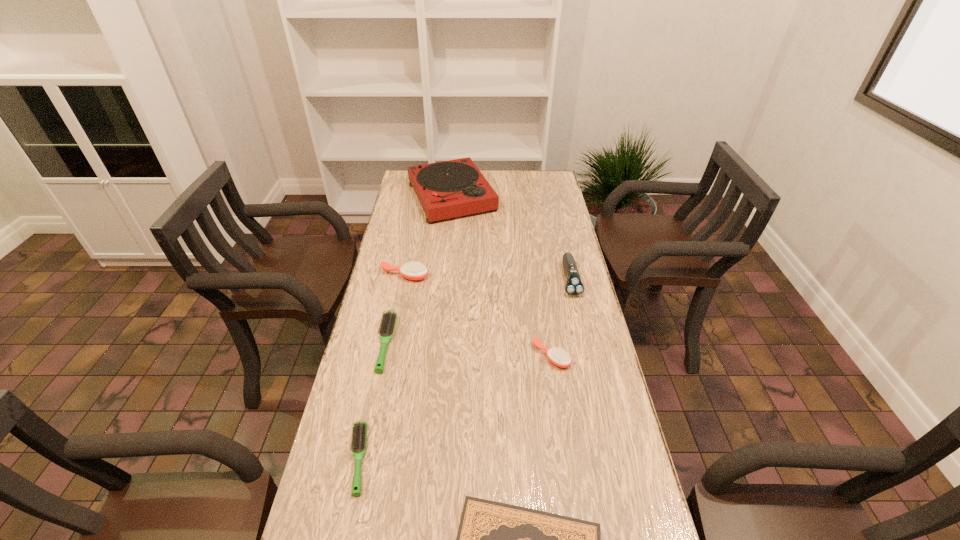
Where is `the sixth farthest object`? This screenshot has width=960, height=540. the sixth farthest object is located at coordinates (359, 437).

Find the location of a particular element. Image resolution: width=960 pixels, height=540 pixels. vacant region located 0.240m on the right of the farthest object is located at coordinates (551, 197).

The image size is (960, 540). Find the location of `vacant space located 0.380m on the head of the second tallest object`. vacant space located 0.380m on the head of the second tallest object is located at coordinates (596, 396).

This screenshot has height=540, width=960. In order to click on free space located on the front of the farthest hairbrush in this screenshot , I will do `click(391, 346)`.

Where is `vacant space located 0.380m on the back of the farther light hairbrush`? vacant space located 0.380m on the back of the farther light hairbrush is located at coordinates (406, 246).

You are a GUI agent. You are given a task and a screenshot of the screen. Output one action in this format:
    pyautogui.click(x=<x>, y=<y>)
    Task: Click on the vacant space situated on the back of the nearer orange hairbrush
    Image resolution: width=960 pixels, height=540 pixels.
    Given the screenshot: What is the action you would take?
    pyautogui.click(x=545, y=314)

Where is `free space located on the back of the nearer light hairbrush`? The height and width of the screenshot is (540, 960). free space located on the back of the nearer light hairbrush is located at coordinates (380, 355).

The width and height of the screenshot is (960, 540). I want to click on object present at the far edge, so click(x=453, y=188).

Where is `record player present at the left edge`? This screenshot has width=960, height=540. record player present at the left edge is located at coordinates (453, 188).

Find the location of a particular element. electric shaver located in the right edge section of the desktop is located at coordinates (574, 286).